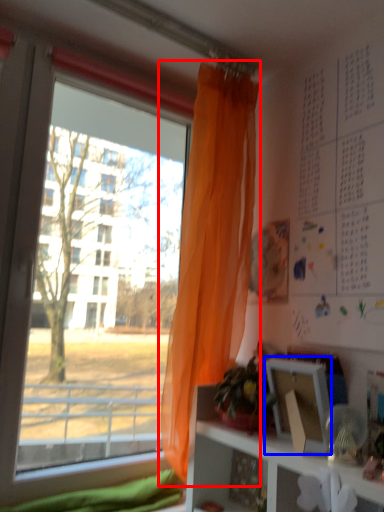
Question: Which object appears closest to the camera in this image, curtain (highlighted by a red box) or picture frame (highlighted by a blue box)?

Choices:
 (A) curtain
 (B) picture frame

Answer: (B)